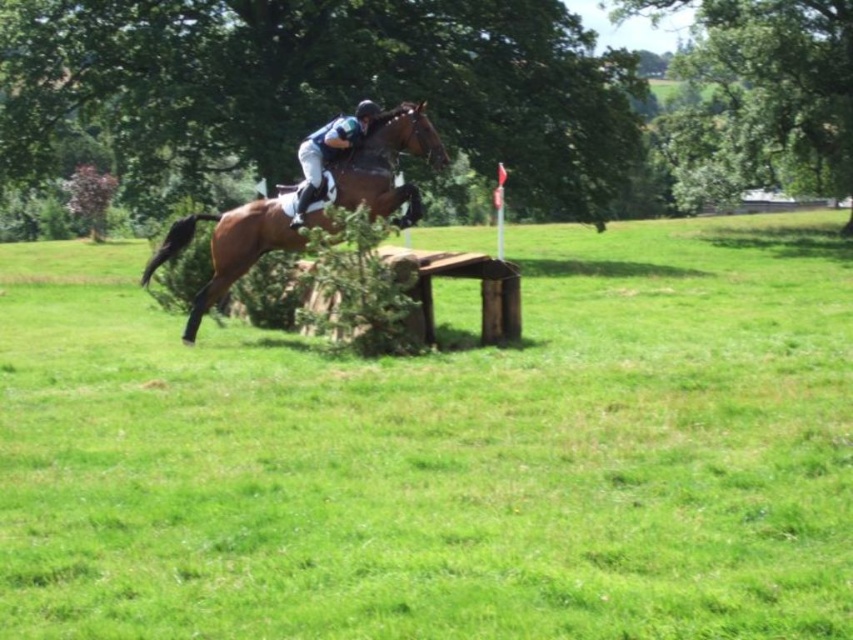
Is point (379, 160) behind point (355, 131)?

That is True.

Between point (187, 227) and point (309, 202), which one is positioned behind?

The point (187, 227) is more distant.

This screenshot has height=640, width=853. I want to click on brown glossy horse at center, so click(386, 163).

Can you confirm if brown wooden fence at center is bigger than shiny blue helmet at center?

Yes, brown wooden fence at center is bigger than shiny blue helmet at center.

Which of these two, brown wooden fence at center or shiny blue helmet at center, stands shorter?

brown wooden fence at center

The image size is (853, 640). Find the location of `brown wooden fence at center`. brown wooden fence at center is located at coordinates (442, 451).

Can you confirm if brown wooden fence at center is positioned above brown glossy horse at center?

Yes, brown wooden fence at center is above brown glossy horse at center.

Who is more distant from viewer, (509,512) or (183,236)?

Positioned behind is point (183,236).

What do you see at coordinates (442, 451) in the screenshot? I see `brown wooden fence at center` at bounding box center [442, 451].

In order to click on brown wooden fence at center in this screenshot , I will do click(x=442, y=451).